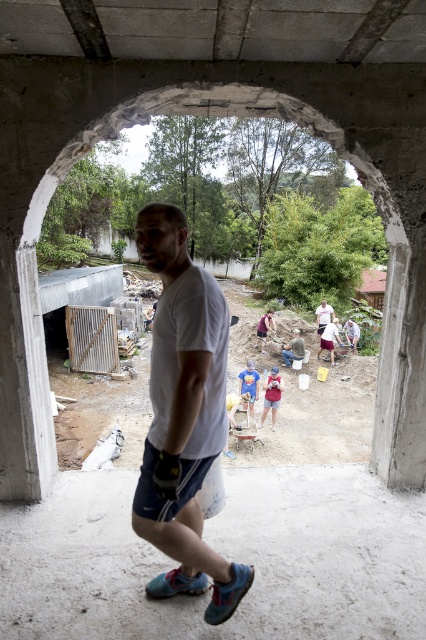
Looking at this image, you are a photographer standing in the scene through the arched opening. You notice two people wearing shorts at the center of the image. Which pair of shorts, matte red shorts at center or blue denim shorts at center, appears larger in height?

The matte red shorts at center appears larger in height than the blue denim shorts at center.